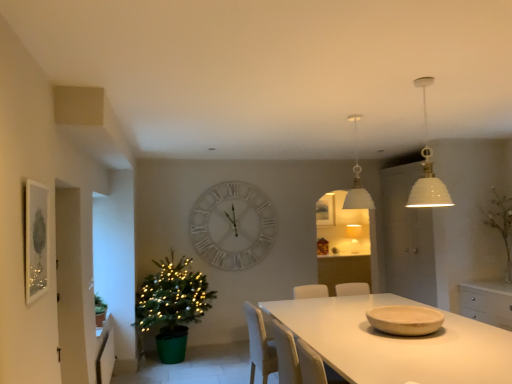
At what (x,y) coordinates should I click in order to perform the action: click on free point above white matte table at center (from a real-world perspective). Please return your answer as a coordinate pair (x, y). Looking at the image, I should click on (396, 340).